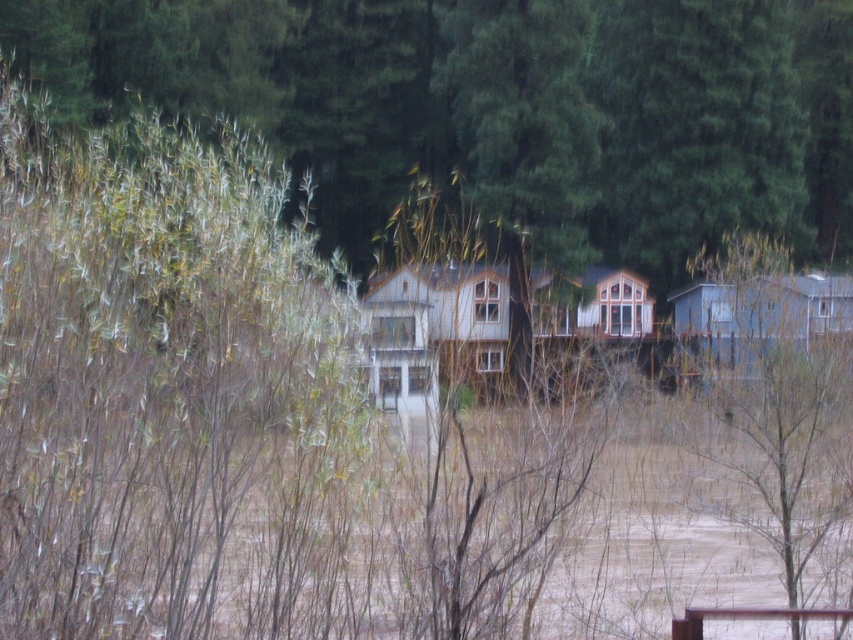
You are a rescue worker assessing the flood situation. You see the white wood cabin at center and the blue wood cabin at right. Which cabin is higher in elevation based on their current visibility above the floodwater?

The white wood cabin at center is taller than the blue wood cabin at right, so it is higher in elevation and more visible above the floodwater.

Based on the photo, you are a hiker trying to navigate through the flooded area. You see the green matte tree at right and the blue wood cabin at right. Which structure is taller and can provide a better vantage point to assess the flood situation?

The green matte tree at right is taller than the blue wood cabin at right, so it would provide a better vantage point to assess the flood situation.